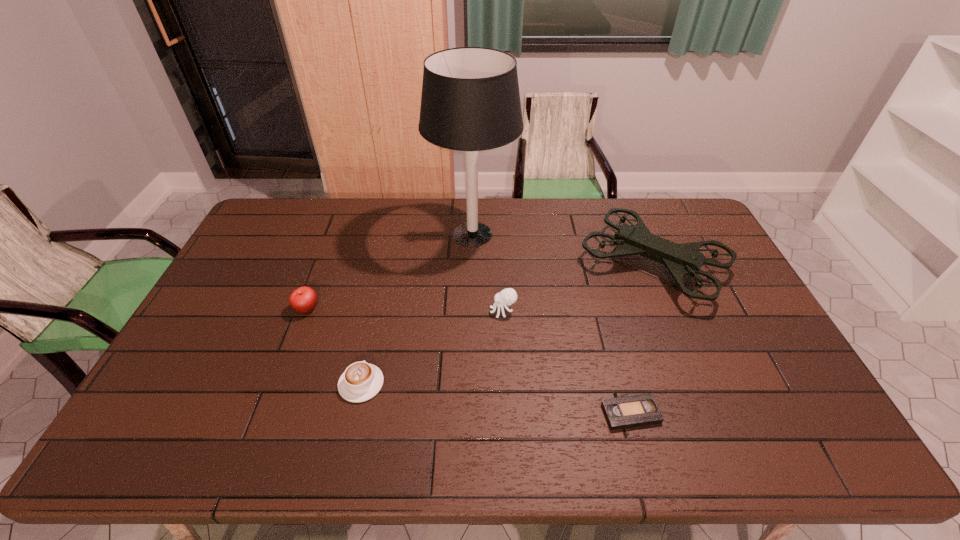
Where is `vacant space positioned on the front-facing side of the octopus`? The image size is (960, 540). vacant space positioned on the front-facing side of the octopus is located at coordinates (404, 311).

The width and height of the screenshot is (960, 540). I want to click on vacant space located 0.260m on the front-facing side of the octopus, so click(404, 311).

Find the location of a particular element. The width and height of the screenshot is (960, 540). free space located 0.400m on the back of the leftmost object is located at coordinates (340, 221).

This screenshot has height=540, width=960. I want to click on vacant space located with the handle on the right side of the cappuccino, so click(375, 322).

Where is `vacant space located 0.060m with the handle on the right side of the cappuccino`? vacant space located 0.060m with the handle on the right side of the cappuccino is located at coordinates (370, 347).

The image size is (960, 540). Identify the location of vacant space located with the handle on the right side of the cappuccino. (372, 336).

Where is `vacant region located 0.230m on the right of the videotape`? Image resolution: width=960 pixels, height=540 pixels. vacant region located 0.230m on the right of the videotape is located at coordinates (752, 413).

Identify the location of table lamp located at the far edge. This screenshot has width=960, height=540. (470, 101).

The image size is (960, 540). Identify the location of drone that is at the far edge. (684, 259).

Locate an element on the screen. The width and height of the screenshot is (960, 540). object at the near edge is located at coordinates (638, 410).